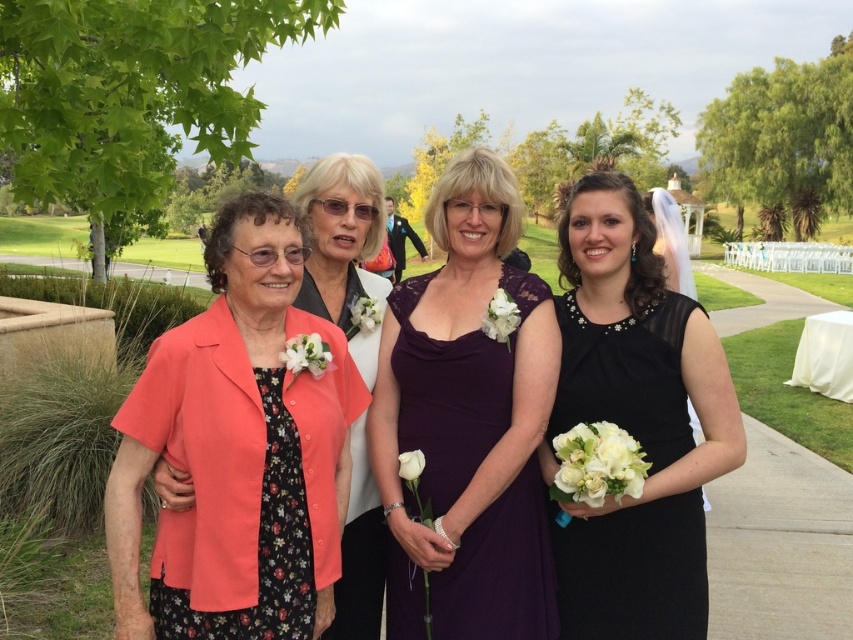
Question: Based on their relative distances, which object is nearer to the matte coral blouse at center?

Choices:
 (A) black satin dress at right
 (B) purple lace dress at center
 (C) matte coral cardigan at left

Answer: (B)

Question: Does matte coral cardigan at left have a lesser width compared to black satin dress at right?

Choices:
 (A) no
 (B) yes

Answer: (A)

Question: Can you confirm if purple lace dress at center is positioned below matte coral blouse at center?

Choices:
 (A) no
 (B) yes

Answer: (B)

Question: Estimate the real-world distances between objects in this image. Which object is closer to the matte coral blouse at center?

Choices:
 (A) purple lace dress at center
 (B) black satin dress at right

Answer: (A)

Question: Considering the real-world distances, which object is closest to the black satin dress at right?

Choices:
 (A) purple lace dress at center
 (B) matte coral cardigan at left

Answer: (A)

Question: Does black satin dress at right appear under matte coral blouse at center?

Choices:
 (A) yes
 (B) no

Answer: (A)